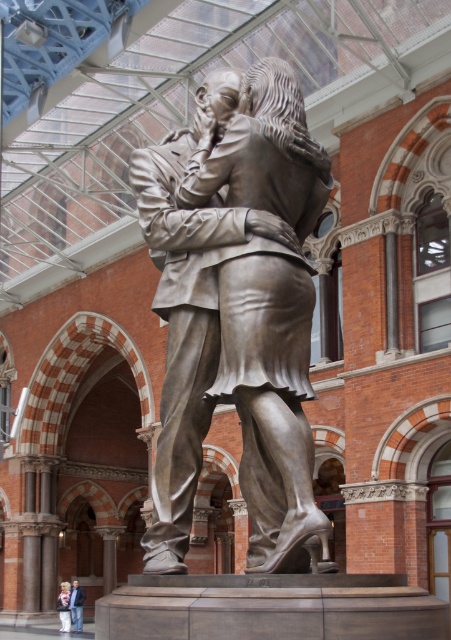
Question: Is bronze statue at center thinner than blue jeans at lower left?

Choices:
 (A) no
 (B) yes

Answer: (A)

Question: Estimate the real-world distances between objects in this image. Which object is farther from the blue jeans at lower left?

Choices:
 (A) bronze statue at center
 (B) white cotton shirt at lower left

Answer: (A)

Question: Is blue jeans at lower left further to the viewer compared to white cotton shirt at lower left?

Choices:
 (A) yes
 (B) no

Answer: (A)

Question: Can you confirm if bronze statue at center is positioned below blue jeans at lower left?

Choices:
 (A) yes
 (B) no

Answer: (B)

Question: Among these points, which one is farthest from the camera?

Choices:
 (A) (178, 518)
 (B) (78, 632)
 (C) (59, 593)

Answer: (C)

Question: Based on their relative distances, which object is farther from the bronze statue at center?

Choices:
 (A) blue jeans at lower left
 (B) white cotton shirt at lower left

Answer: (A)